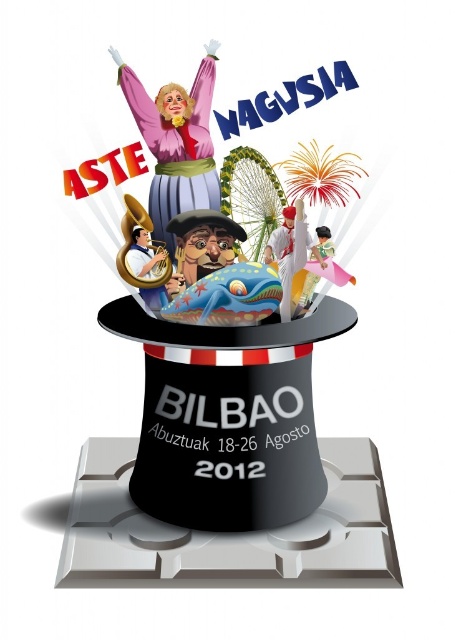
You are at the festival and see the matte black hat at center and the matte pink dress at upper center. Which one appears wider in the image?

The matte black hat at center might be wider than matte pink dress at upper center according to the description.

What is the relationship between the size of the matte black hat at center and the matte pink dress at upper center?

The matte black hat at center is larger in size than the matte pink dress at upper center.

What is the spatial relationship between the matte black hat at center and the matte pink dress at upper center?

The matte black hat at center is below the matte pink dress at upper center.